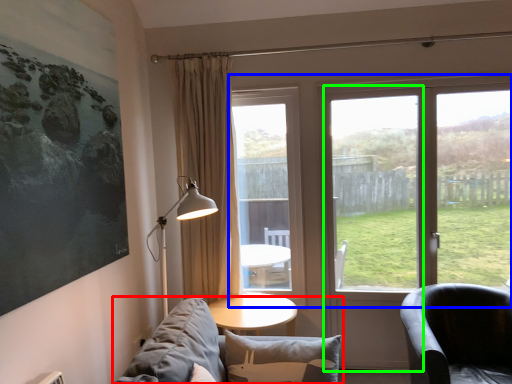
Question: Considering the real-world distances, which object is closest to studio couch (highlighted by a red box)? window (highlighted by a blue box) or screen door (highlighted by a green box).

Choices:
 (A) window
 (B) screen door

Answer: (B)